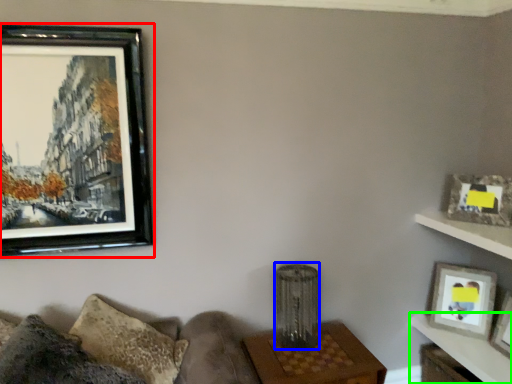
Question: Which is nearer to the picture frame (highlighted by a red box)? lamp (highlighted by a blue box) or table (highlighted by a green box).

Choices:
 (A) lamp
 (B) table

Answer: (A)